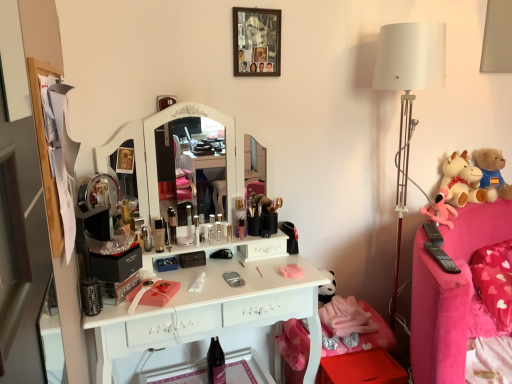
The width and height of the screenshot is (512, 384). What do you see at coordinates (294, 350) in the screenshot?
I see `pink fabric swivel chair at lower right` at bounding box center [294, 350].

The height and width of the screenshot is (384, 512). Describe the element at coordinates (461, 180) in the screenshot. I see `white plush cow at right, which appears as the 2th toy when viewed from the left` at that location.

I want to click on soft plush cow at right, acting as the 3th toy starting from the left, so click(492, 173).

Could you measure the distance between wooden picture frame at upper center and soft plush cow at right, the first toy viewed from the right?

wooden picture frame at upper center is 1.28 meters from soft plush cow at right, the first toy viewed from the right.

Which object is further away from the camera, wooden picture frame at upper center or soft plush cow at right, the first toy viewed from the right?

soft plush cow at right, the first toy viewed from the right, is behind.

Based on the photo, does wooden picture frame at upper center turn towards soft plush cow at right, the first toy viewed from the right?

No, wooden picture frame at upper center is not aimed at soft plush cow at right, the first toy viewed from the right.

From the image's perspective, is wooden picture frame at upper center beneath soft plush cow at right, acting as the 3th toy starting from the left?

Actually, wooden picture frame at upper center appears above soft plush cow at right, acting as the 3th toy starting from the left, in the image.

The image size is (512, 384). Identify the location of the 3rd toy behind the satin gold makeup brush holder at center, placed as the sixth toiletry when sorted from left to right, starting your count from the anchor. (492, 173).

Is satin gold makeup brush holder at center, placed as the sixth toiletry when sorted from left to right, turned away from soft plush cow at right, the first toy viewed from the right?

No, satin gold makeup brush holder at center, placed as the sixth toiletry when sorted from left to right,'s orientation is not away from soft plush cow at right, the first toy viewed from the right.

Considering the points (239, 229) and (487, 172), which point is in front, point (239, 229) or point (487, 172)?

Point (239, 229)

Considering the relative positions of satin gold makeup brush holder at center, placed as the sixth toiletry when sorted from left to right, and soft plush cow at right, the first toy viewed from the right, in the image provided, is satin gold makeup brush holder at center, placed as the sixth toiletry when sorted from left to right, to the left of soft plush cow at right, the first toy viewed from the right, from the viewer's perspective?

Correct, you'll find satin gold makeup brush holder at center, placed as the sixth toiletry when sorted from left to right, to the left of soft plush cow at right, the first toy viewed from the right.

Based on the photo, how distant is metallic silver toiletry at center, the first toiletry positioned from the left, from wooden picture frame at upper center?

34.61 inches.

Is metallic silver toiletry at center, the first toiletry positioned from the left, oriented away from wooden picture frame at upper center?

No, metallic silver toiletry at center, the first toiletry positioned from the left,'s orientation is not away from wooden picture frame at upper center.

From a real-world perspective, is metallic silver toiletry at center, the first toiletry positioned from the left, located higher than wooden picture frame at upper center?

No, from a real-world perspective, metallic silver toiletry at center, the first toiletry positioned from the left, is not over wooden picture frame at upper center

Between metallic silver toiletry at center, the first toiletry positioned from the left, and wooden picture frame at upper center, which one has more height?

wooden picture frame at upper center is taller.

In the scene shown: Is metallic silver toiletry at center, which is the fourth toiletry in left-to-right order, not near pink fabric swivel chair at lower right?

metallic silver toiletry at center, which is the fourth toiletry in left-to-right order, is actually quite close to pink fabric swivel chair at lower right.

Can we say metallic silver toiletry at center, which is the fourth toiletry in left-to-right order, lies outside pink fabric swivel chair at lower right?

metallic silver toiletry at center, which is the fourth toiletry in left-to-right order, is positioned outside pink fabric swivel chair at lower right.

Considering the relative sizes of metallic silver toiletry at center, which is the fourth toiletry in left-to-right order, and pink fabric swivel chair at lower right in the image provided, is metallic silver toiletry at center, which is the fourth toiletry in left-to-right order, smaller than pink fabric swivel chair at lower right?

Correct, metallic silver toiletry at center, which is the fourth toiletry in left-to-right order, occupies less space than pink fabric swivel chair at lower right.

Can you tell me how much metallic silver toiletry at center, which is the fourth toiletry in left-to-right order, and pink fabric swivel chair at lower right differ in facing direction?

They differ by 6.9 degrees in their facing directions.

Locate an element on the screen. This screenshot has height=384, width=512. picture frame that appears above the satin gold makeup brush holder at center, placed as the sixth toiletry when sorted from left to right (from the image's perspective) is located at coordinates (256, 41).

Is wooden picture frame at upper center oriented away from satin gold makeup brush holder at center, the 1th toiletry when ordered from right to left?

No, wooden picture frame at upper center's orientation is not away from satin gold makeup brush holder at center, the 1th toiletry when ordered from right to left.

From a real-world perspective, is wooden picture frame at upper center below satin gold makeup brush holder at center, the 1th toiletry when ordered from right to left?

No, from a real-world perspective, wooden picture frame at upper center is not below satin gold makeup brush holder at center, the 1th toiletry when ordered from right to left.

Which of these two, wooden picture frame at upper center or satin gold makeup brush holder at center, the 1th toiletry when ordered from right to left, stands taller?

Standing taller between the two is wooden picture frame at upper center.

How distant is metallic silver toiletry at center, the first toiletry positioned from the left, from soft plush cow at right, acting as the 3th toy starting from the left?

metallic silver toiletry at center, the first toiletry positioned from the left, is 5.70 feet from soft plush cow at right, acting as the 3th toy starting from the left.

From a real-world perspective, is metallic silver toiletry at center, the first toiletry positioned from the left, under soft plush cow at right, acting as the 3th toy starting from the left?

Yes, from a real-world perspective, metallic silver toiletry at center, the first toiletry positioned from the left, is below soft plush cow at right, acting as the 3th toy starting from the left.

Which point is more forward, (x=144, y=238) or (x=500, y=194)?

The point (x=144, y=238) is closer to the camera.

From the image's perspective, which is below, metallic silver toiletry at center, the first toiletry positioned from the left, or soft plush cow at right, acting as the 3th toy starting from the left?

metallic silver toiletry at center, the first toiletry positioned from the left, appears lower in the image.

Can you confirm if satin gold makeup brush holder at center, the 1th toiletry when ordered from right to left, is thinner than translucent plastic container at center, which is the fifth toiletry in left-to-right order?

No, satin gold makeup brush holder at center, the 1th toiletry when ordered from right to left, is not thinner than translucent plastic container at center, which is the fifth toiletry in left-to-right order.

Is satin gold makeup brush holder at center, placed as the sixth toiletry when sorted from left to right, in contact with translucent plastic container at center, which is the fifth toiletry in left-to-right order?

Indeed, satin gold makeup brush holder at center, placed as the sixth toiletry when sorted from left to right, and translucent plastic container at center, which is the fifth toiletry in left-to-right order, are beside each other and touching.

Which is less distant, (244, 222) or (228, 237)?

The point (228, 237) is in front.

At what (x,y) coordinates should I click in order to perform the action: click on the 2nd toy directly beneath the wooden picture frame at upper center (from a real-world perspective). Please return your answer as a coordinate pair (x, y). The image size is (512, 384). Looking at the image, I should click on (492, 173).

I want to click on the 3rd toy above when counting from the satin gold makeup brush holder at center, the 1th toiletry when ordered from right to left (from the image's perspective), so (x=492, y=173).

Which object lies nearer to the anchor point satin gold makeup brush holder at center, the 1th toiletry when ordered from right to left, metallic silver toiletry at center, which is the 3th toiletry in right-to-left order, or pink fabric plush at right, the third toy in the right-to-left sequence?

The object closer to satin gold makeup brush holder at center, the 1th toiletry when ordered from right to left, is metallic silver toiletry at center, which is the 3th toiletry in right-to-left order.

Considering their positions, is pink fabric swivel chair at lower right positioned further to translucent plastic container at center, the 2th toiletry in the right-to-left sequence, than pink fabric plush at right, the third toy in the right-to-left sequence?

Among the two, pink fabric plush at right, the third toy in the right-to-left sequence, is located further to translucent plastic container at center, the 2th toiletry in the right-to-left sequence.

When comparing their distances from pink fabric swivel chair at lower right, does metallic silver toiletry at center, which is the second toiletry in left-to-right order, or translucent plastic container at center, which is the fifth toiletry in left-to-right order, seem further?

Based on the image, metallic silver toiletry at center, which is the second toiletry in left-to-right order, appears to be further to pink fabric swivel chair at lower right.

When comparing their distances from matte black lipstick at center, arranged as the third toiletry when viewed from the left, does metallic silver toiletry at center, which is the second toiletry in left-to-right order, or metallic silver toiletry at center, which is the 3th toiletry in right-to-left order, seem further?

Based on the image, metallic silver toiletry at center, which is the 3th toiletry in right-to-left order, appears to be further to matte black lipstick at center, arranged as the third toiletry when viewed from the left.

From the image, which object appears to be nearer to white plush cow at right, which appears as the 2th toy when viewed from the left, metallic silver toiletry at center, which is the 3th toiletry in right-to-left order, or metallic silver toiletry at center, which is the second toiletry in left-to-right order?

Among the two, metallic silver toiletry at center, which is the 3th toiletry in right-to-left order, is located nearer to white plush cow at right, which appears as the 2th toy when viewed from the left.

When comparing their distances from white fabric lampshade at right, does satin gold makeup brush holder at center, placed as the sixth toiletry when sorted from left to right, or metallic silver toiletry at center, the first toiletry positioned from the left, seem further?

metallic silver toiletry at center, the first toiletry positioned from the left, lies further to white fabric lampshade at right than the other object.

Estimate the real-world distances between objects in this image. Which object is further from white fabric lampshade at right, translucent plastic container at center, the 2th toiletry in the right-to-left sequence, or pink fabric plush at right, the third toy in the right-to-left sequence?

The object further to white fabric lampshade at right is translucent plastic container at center, the 2th toiletry in the right-to-left sequence.

From the picture: Based on their spatial positions, is white fabric lampshade at right or matte black lipstick at center, the fourth toiletry positioned from the right, closer to soft plush cow at right, the first toy viewed from the right?

Among the two, white fabric lampshade at right is located nearer to soft plush cow at right, the first toy viewed from the right.

Find the location of a particular element. Image resolution: width=512 pixels, height=384 pixels. picture frame situated between translucent plastic container at center, which is the fifth toiletry in left-to-right order, and soft plush cow at right, the first toy viewed from the right, from left to right is located at coordinates (256, 41).

Image resolution: width=512 pixels, height=384 pixels. I want to click on picture frame between metallic silver toiletry at center, which is the fourth toiletry in left-to-right order, and soft plush cow at right, acting as the 3th toy starting from the left, so click(256, 41).

Identify the location of table lamp situated between translucent plastic container at center, the 2th toiletry in the right-to-left sequence, and pink fabric plush at right, the third toy in the right-to-left sequence, from left to right. The width and height of the screenshot is (512, 384). (408, 95).

Where is `toy between wooden picture frame at upper center and white plush cow at right, which appears as the 2th toy when viewed from the left`? This screenshot has width=512, height=384. toy between wooden picture frame at upper center and white plush cow at right, which appears as the 2th toy when viewed from the left is located at coordinates (440, 209).